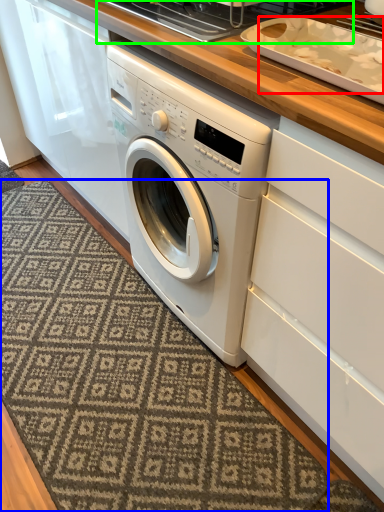
Question: Considering the real-world distances, which object is closest to food (highlighted by a red box)? doormat (highlighted by a blue box) or appliance (highlighted by a green box).

Choices:
 (A) doormat
 (B) appliance

Answer: (B)